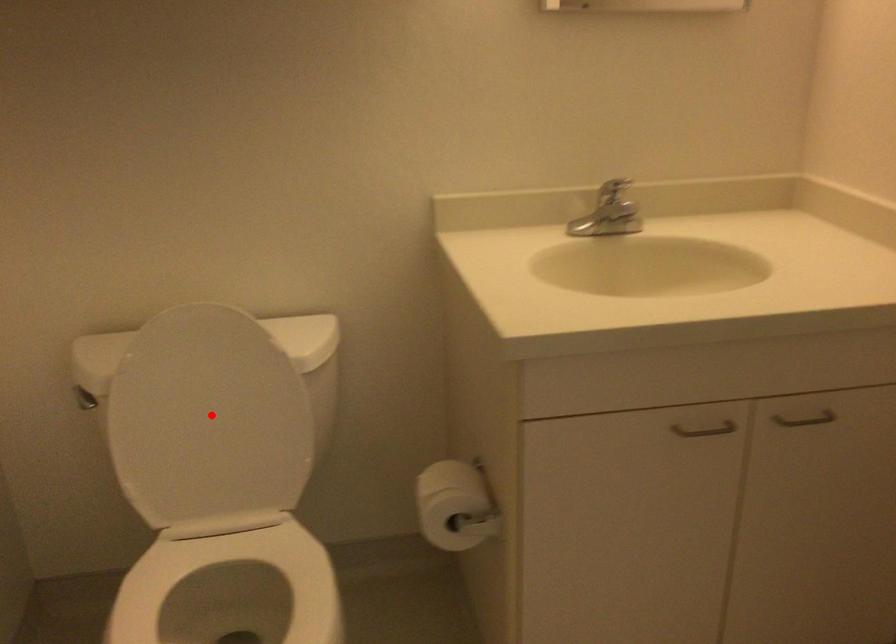
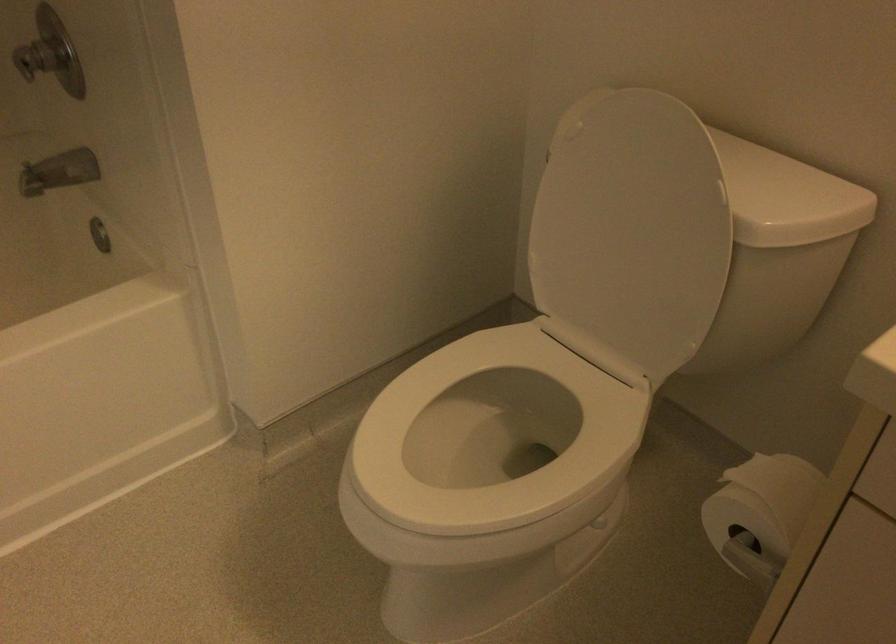
Question: I am providing you with two images of the same scene from different viewpoints. A red point is shown in image1. For the corresponding object point in image2, is it positioned nearer or farther from the camera?

Choices:
 (A) Nearer
 (B) Farther

Answer: (A)